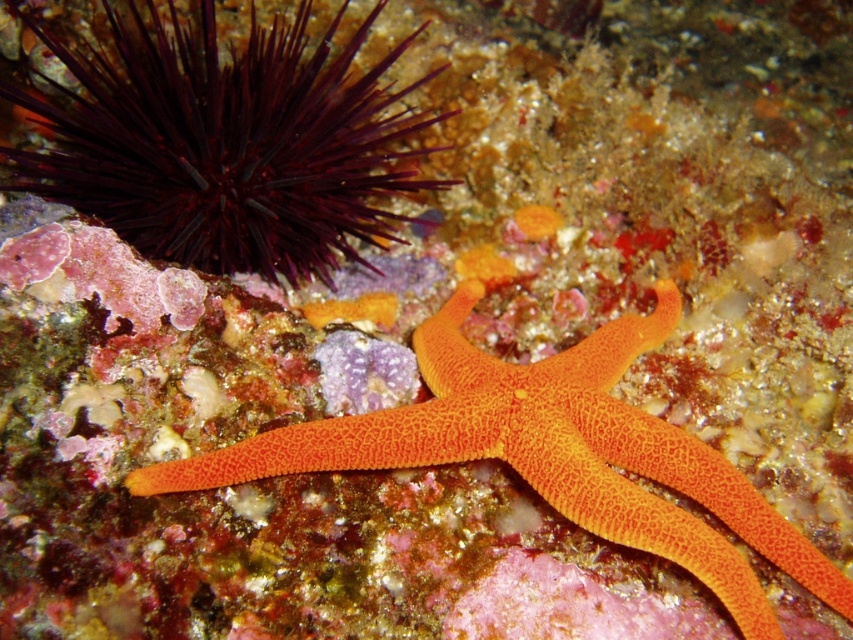
Question: Considering the relative positions of dark spiny sea urchin at upper left and orange rough-textured starfish at center in the image provided, where is dark spiny sea urchin at upper left located with respect to orange rough-textured starfish at center?

Choices:
 (A) above
 (B) below

Answer: (A)

Question: Which point is closer to the camera?

Choices:
 (A) (442, 460)
 (B) (157, 220)

Answer: (A)

Question: Among these points, which one is nearest to the camera?

Choices:
 (A) click(x=434, y=68)
 (B) click(x=374, y=448)

Answer: (B)

Question: Is dark spiny sea urchin at upper left smaller than orange rough-textured starfish at center?

Choices:
 (A) no
 (B) yes

Answer: (A)

Question: Is dark spiny sea urchin at upper left to the left of orange rough-textured starfish at center from the viewer's perspective?

Choices:
 (A) no
 (B) yes

Answer: (B)